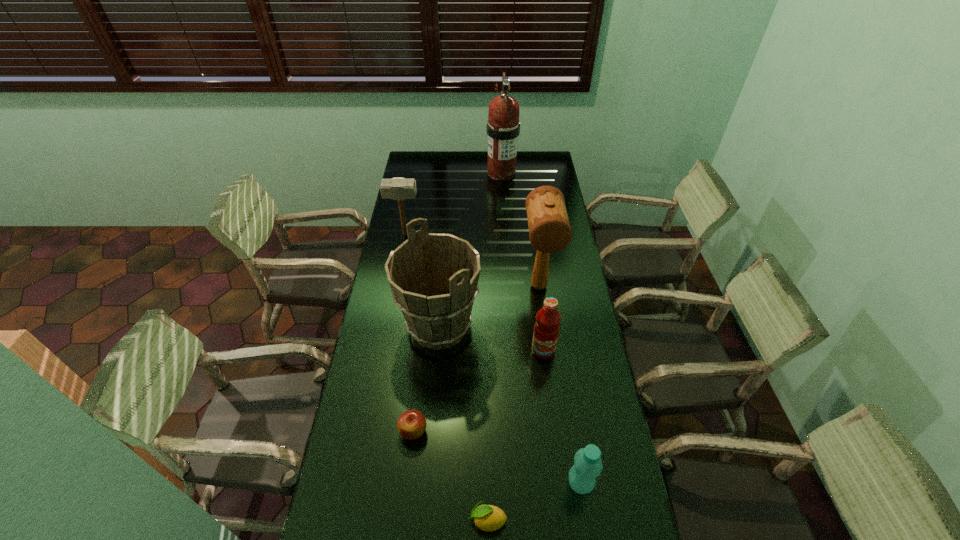
Locate an element on the screen. vacant point located with leaves positioned above the shortest object is located at coordinates (363, 520).

Where is `blank space located 0.160m with leaves positioned above the shortest object`? The image size is (960, 540). blank space located 0.160m with leaves positioned above the shortest object is located at coordinates (408, 520).

You are a GUI agent. You are given a task and a screenshot of the screen. Output one action in this format:
    pyautogui.click(x=<x>, y=<y>)
    Task: Click on the vacant space located 0.280m with leaves positioned above the shortest object
    
    Given the screenshot: What is the action you would take?
    pyautogui.click(x=363, y=520)

Identify the location of object at the far edge. (503, 127).

I want to click on bucket that is at the left edge, so [434, 277].

At what (x,y) coordinates should I click in order to perform the action: click on mallet situated at the left edge. Please return your answer as a coordinate pair (x, y). Looking at the image, I should click on (398, 189).

Where is `apple present at the left edge`? This screenshot has height=540, width=960. apple present at the left edge is located at coordinates (411, 424).

You are a GUI agent. You are given a task and a screenshot of the screen. Output one action in this format:
    pyautogui.click(x=<x>, y=<y>)
    Task: Click on the mallet at the right edge
    This screenshot has width=960, height=540.
    Given the screenshot: What is the action you would take?
    pyautogui.click(x=549, y=229)

Image resolution: width=960 pixels, height=540 pixels. I want to click on fruit juice present at the right edge, so pos(546,329).

Find the location of `bottle that is at the right edge`. bottle that is at the right edge is located at coordinates (587, 466).